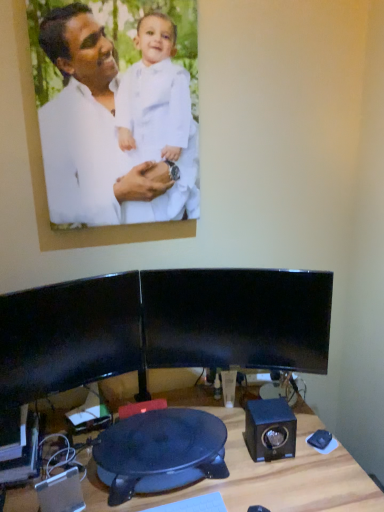
Question: From a real-world perspective, does black plastic speaker at lower left, the 2th speaker when ordered from back to front, sit lower than black plastic swivel chair at center?

Choices:
 (A) no
 (B) yes

Answer: (A)

Question: Can you confirm if black plastic speaker at lower left, marked as the 1th speaker in a front-to-back arrangement, is thinner than black plastic swivel chair at center?

Choices:
 (A) yes
 (B) no

Answer: (A)

Question: Is black plastic speaker at lower left, the 2th speaker when ordered from back to front, far away from black plastic swivel chair at center?

Choices:
 (A) yes
 (B) no

Answer: (B)

Question: Can you confirm if black plastic speaker at lower left, which ranks as the 1th speaker in left-to-right order, is wider than black plastic swivel chair at center?

Choices:
 (A) yes
 (B) no

Answer: (B)

Question: Is black plastic speaker at lower left, marked as the 1th speaker in a front-to-back arrangement, facing away from black plastic swivel chair at center?

Choices:
 (A) no
 (B) yes

Answer: (A)

Question: In terms of width, does blue matte speaker at lower right, the first speaker viewed from the back, look wider or thinner when compared to wooden desk at lower center?

Choices:
 (A) thin
 (B) wide

Answer: (A)

Question: Considering the relative positions of blue matte speaker at lower right, which appears as the 2th speaker when viewed from the front, and wooden desk at lower center in the image provided, is blue matte speaker at lower right, which appears as the 2th speaker when viewed from the front, to the left or to the right of wooden desk at lower center?

Choices:
 (A) left
 (B) right

Answer: (B)

Question: Relative to wooden desk at lower center, is blue matte speaker at lower right, the first speaker viewed from the back, in front or behind?

Choices:
 (A) behind
 (B) front

Answer: (A)

Question: Is blue matte speaker at lower right, the first speaker viewed from the back, taller or shorter than wooden desk at lower center?

Choices:
 (A) tall
 (B) short

Answer: (B)

Question: From a real-world perspective, relative to black plastic speaker at lower left, marked as the 1th speaker in a front-to-back arrangement, is white matte picture frame at upper left vertically above or below?

Choices:
 (A) above
 (B) below

Answer: (A)

Question: Considering the positions of point pyautogui.click(x=72, y=88) and point pyautogui.click(x=62, y=509), is point pyautogui.click(x=72, y=88) closer or farther from the camera than point pyautogui.click(x=62, y=509)?

Choices:
 (A) closer
 (B) farther

Answer: (B)

Question: Is white matte picture frame at upper left wider or thinner than black plastic speaker at lower left, which ranks as the 1th speaker in left-to-right order?

Choices:
 (A) wide
 (B) thin

Answer: (B)

Question: From the image's perspective, is white matte picture frame at upper left located above or below black plastic speaker at lower left, which is counted as the second speaker, starting from the right?

Choices:
 (A) above
 (B) below

Answer: (A)

Question: Considering the relative positions of black glossy monitor at center, acting as the second computer monitor starting from the left, and wooden desk at lower center in the image provided, is black glossy monitor at center, acting as the second computer monitor starting from the left, to the left or to the right of wooden desk at lower center?

Choices:
 (A) left
 (B) right

Answer: (B)

Question: From a real-world perspective, relative to wooden desk at lower center, is black glossy monitor at center, acting as the second computer monitor starting from the left, vertically above or below?

Choices:
 (A) above
 (B) below

Answer: (A)